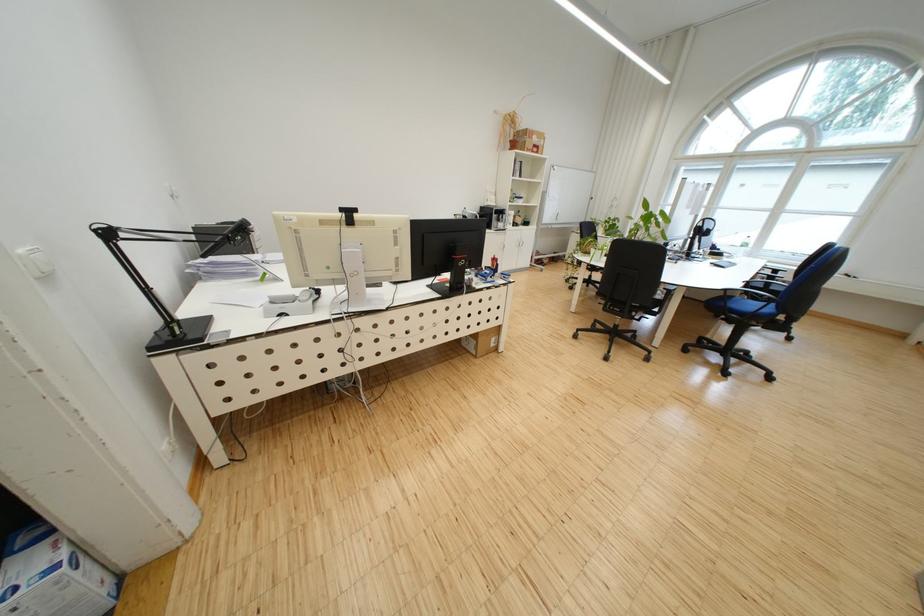
Find where to lift the blue and white box. Please return your answer as a coordinate pair (x, y).

(53, 576)